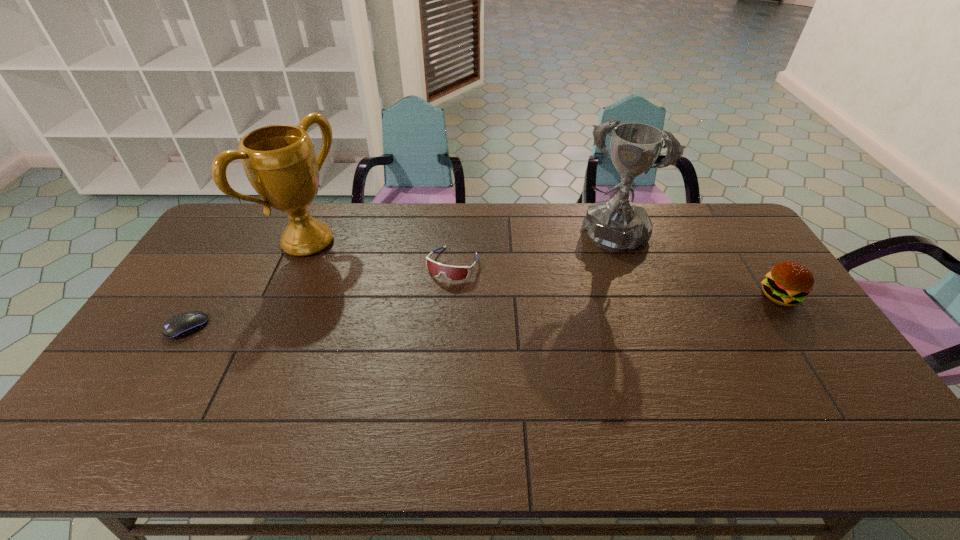
Find the location of `the shortest object`. the shortest object is located at coordinates (181, 325).

The height and width of the screenshot is (540, 960). Find the location of `computer mouse`. computer mouse is located at coordinates (181, 325).

Find the location of a particular element. the third shortest object is located at coordinates (788, 283).

Locate an element on the screen. The height and width of the screenshot is (540, 960). hamburger is located at coordinates (788, 283).

You are a GUI agent. You are given a task and a screenshot of the screen. Output one action in this format:
    pyautogui.click(x=<x>, y=<y>)
    Task: Click on the right award
    
    Given the screenshot: What is the action you would take?
    pyautogui.click(x=616, y=225)

Locate an element on the screen. goggles is located at coordinates (453, 273).

I want to click on the third object from left to right, so click(453, 273).

You are a GUI agent. You are given a task and a screenshot of the screen. Output one action in this format:
    pyautogui.click(x=<x>, y=<y>)
    Task: Click on the second object from left to right
    The width and height of the screenshot is (960, 540).
    Given the screenshot: What is the action you would take?
    pyautogui.click(x=280, y=163)

You are a GUI agent. You are given a task and a screenshot of the screen. Output one action in this format:
    pyautogui.click(x=<x>, y=<y>)
    Task: Click on the free spot located 0.360m on the back of the computer mouse
    The width and height of the screenshot is (960, 540).
    Given the screenshot: What is the action you would take?
    pyautogui.click(x=242, y=238)

The image size is (960, 540). What are the coordinates of `free space located on the back of the hamburger` in the screenshot? It's located at (748, 247).